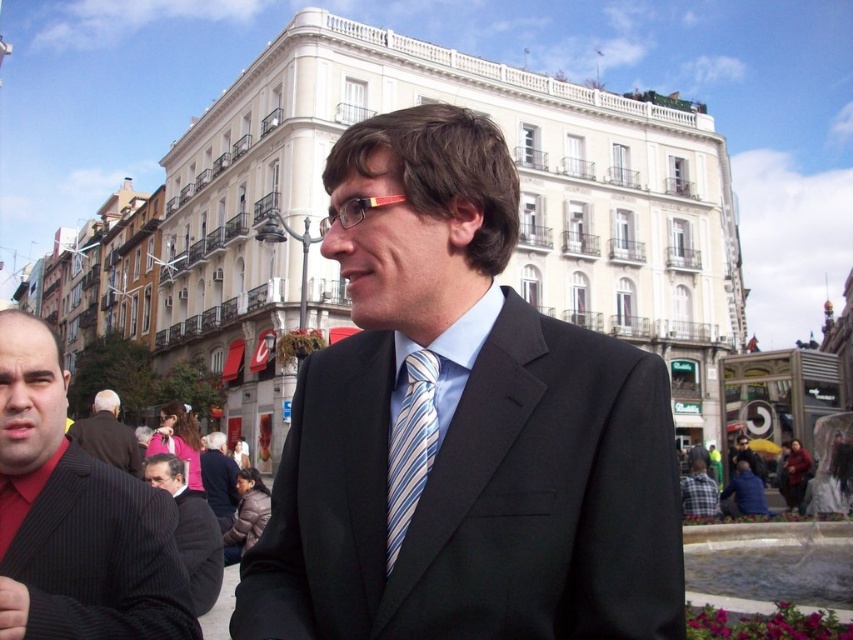
Question: Does black suit at center appear over striped fabric suit at center?

Choices:
 (A) no
 (B) yes

Answer: (B)

Question: Which object appears farthest from the camera in this image?

Choices:
 (A) smooth black suit at lower left
 (B) pink fabric hand at center
 (C) dark gray pinstripe suit at lower left

Answer: (B)

Question: Does red pinstripe suit at left have a larger size compared to dark gray pinstripe suit at lower left?

Choices:
 (A) yes
 (B) no

Answer: (A)

Question: Which object is closer to the camera taking this photo?

Choices:
 (A) red pinstripe suit at left
 (B) dark gray pinstripe suit at lower left

Answer: (A)

Question: Can you confirm if black suit at center is thinner than dark brown suit at left?

Choices:
 (A) no
 (B) yes

Answer: (B)

Question: Based on their relative distances, which object is farther from the striped fabric suit at center?

Choices:
 (A) black suit at center
 (B) red pinstripe suit at left
 (C) blue striped tie at center
 (D) smooth black suit at lower left

Answer: (C)